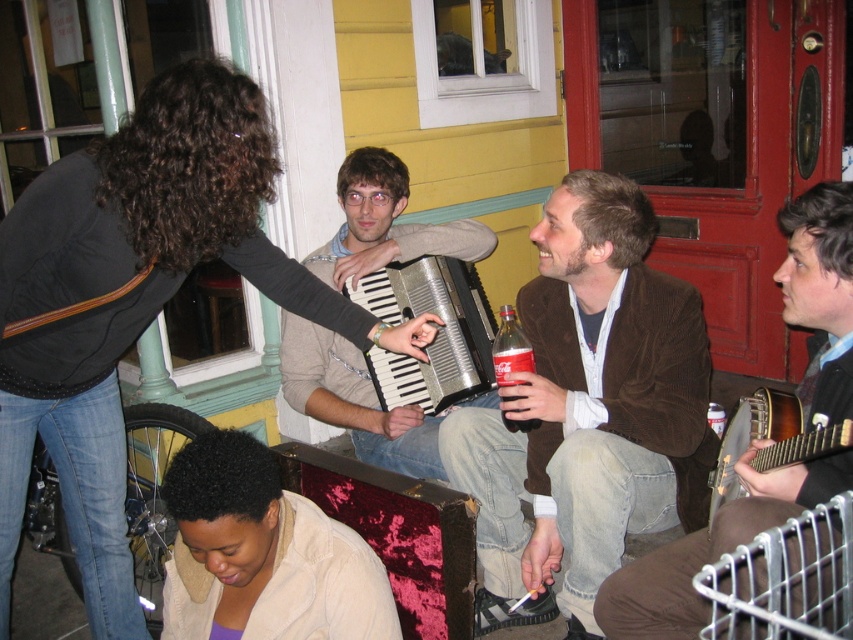
You are a photographer trying to capture a photo of the brown corduroy jacket at center and the metallic silver accordion at center. Based on their sizes, which object should you focus on first if you want to ensure both are in frame without cropping?

The brown corduroy jacket at center is much taller than the metallic silver accordion at center, so you should focus on the brown corduroy jacket at center first to ensure it fits within the frame.

You are a photographer trying to capture a closeup of the metallic silver accordion at center. To do so, you need to ensure the brown corduroy jacket at center isn not blocking your view. Is the jacket currently in the way?

The brown corduroy jacket at center is positioned under the metallic silver accordion at center, so it is not blocking the view of the accordion. You can take the closeup without any obstruction.